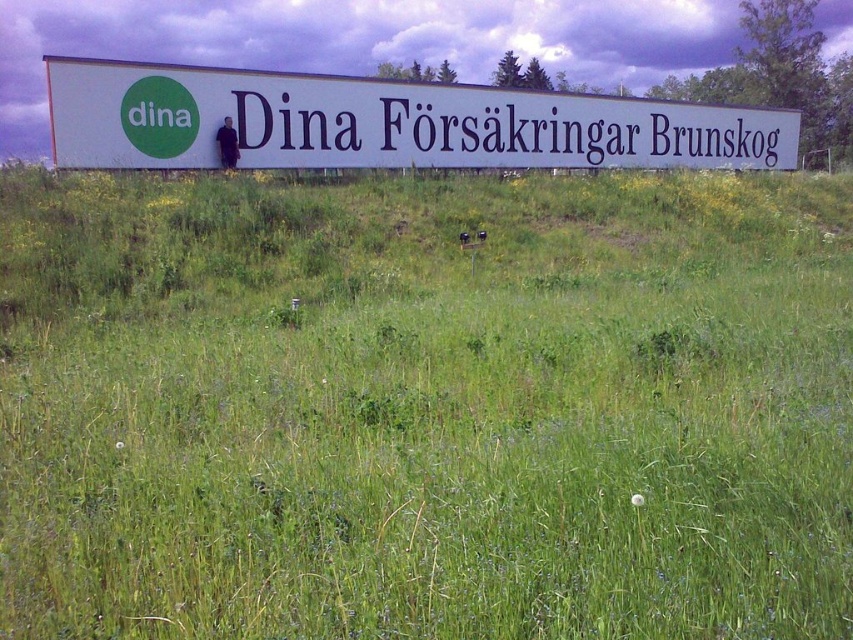
You are a hiker who has just arrived at the billboard area. You see the green grass at center and the white plastic sign at center. Which object is positioned higher relative to the other?

The green grass at center is located above the white plastic sign at center, so the green grass at center is higher than the white plastic sign at center.

You are standing in front of the billboard and want to place a small bench between the green grass at center and the white matte sign at center. Based on their positions, which side of the bench should face the grass?

The bench should face the green grass at center because it is located to the left of the white matte sign at center, so placing the bench between them would require the bench to be positioned with its left side toward the grass.

Based on the photo, you are standing in front of the billboard and want to place a small sign exactly at the center of the green grass at center. According to the coordinates provided, where should you place the sign?

The green grass at center is located at point (425, 406), so you should place the sign at those coordinates to mark its center.